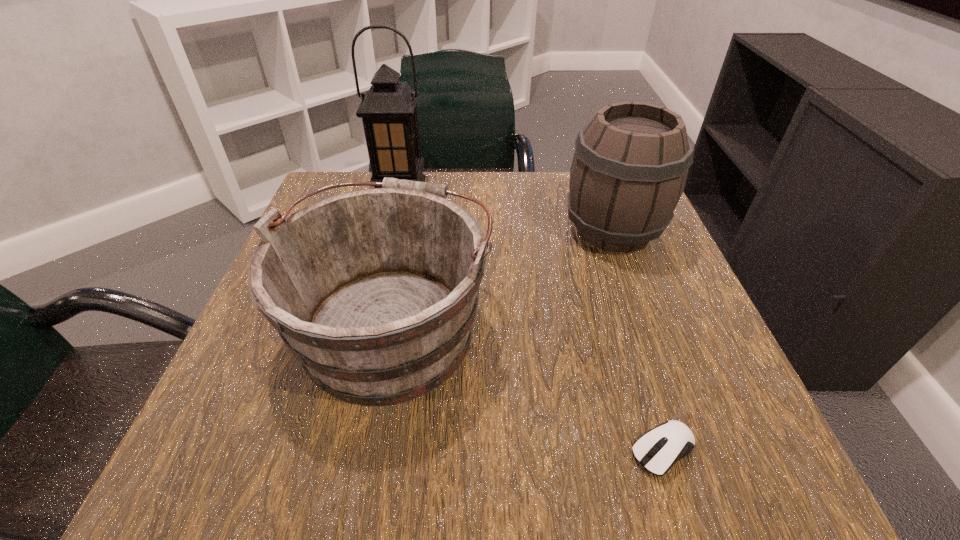
You are a GUI agent. You are given a task and a screenshot of the screen. Output one action in this format:
    pyautogui.click(x=<x>, y=<y>)
    Task: Click on the object that is at the far left corner
    The height and width of the screenshot is (540, 960).
    Given the screenshot: What is the action you would take?
    pyautogui.click(x=388, y=110)

Where is `object positioned at the near left corner`? object positioned at the near left corner is located at coordinates (375, 291).

Locate an element on the screen. Image resolution: width=960 pixels, height=540 pixels. object at the far right corner is located at coordinates (629, 169).

Identify the location of object present at the near right corner. The height and width of the screenshot is (540, 960). (657, 450).

Where is `vacant space at the far edge of the desktop`? The height and width of the screenshot is (540, 960). vacant space at the far edge of the desktop is located at coordinates (472, 180).

Identify the location of free location at the near edge of the desktop. The width and height of the screenshot is (960, 540). (x=340, y=469).

In the image, there is a desktop. Where is `free region at the right edge`? The width and height of the screenshot is (960, 540). free region at the right edge is located at coordinates (624, 294).

This screenshot has width=960, height=540. I want to click on free space at the near left corner, so click(x=242, y=453).

You are a GUI agent. You are given a task and a screenshot of the screen. Output one action in this format:
    pyautogui.click(x=<x>, y=<y>)
    Task: Click on the free spot between the tallest object and the nearest object
    The image size is (960, 540).
    Given the screenshot: What is the action you would take?
    pyautogui.click(x=532, y=319)

Find the location of a particular element. The height and width of the screenshot is (540, 960). vacant area that lies between the nearest object and the third shortest object is located at coordinates (638, 340).